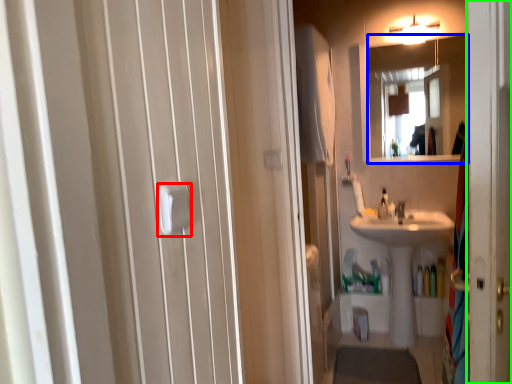
Question: Which object is positioned closest to towel bar (highlighted by a red box)? Select from mirror (highlighted by a blue box) and screen door (highlighted by a green box).

Choices:
 (A) mirror
 (B) screen door

Answer: (B)